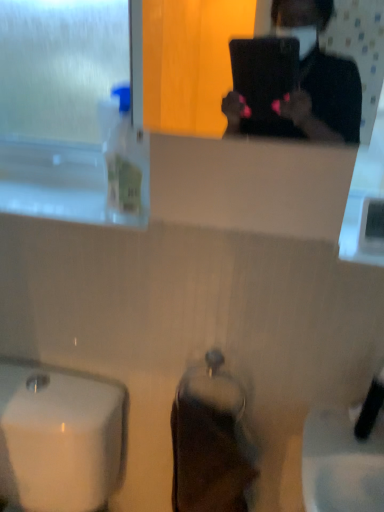
Question: Which is correct: clear plastic bottle at left is inside white glossy sink at lower left, or outside of it?

Choices:
 (A) outside
 (B) inside

Answer: (A)

Question: In terms of width, does clear plastic bottle at left look wider or thinner when compared to white glossy sink at lower left?

Choices:
 (A) wide
 (B) thin

Answer: (B)

Question: Estimate the real-world distances between objects in this image. Which object is farther from the frosted glass window screen at upper left?

Choices:
 (A) clear plastic bottle at left
 (B) black matte laptop at upper center
 (C) white glossy sink at lower left

Answer: (C)

Question: Which object is the closest to the black matte laptop at upper center?

Choices:
 (A) white glossy sink at lower left
 (B) clear plastic bottle at left
 (C) frosted glass window screen at upper left

Answer: (B)